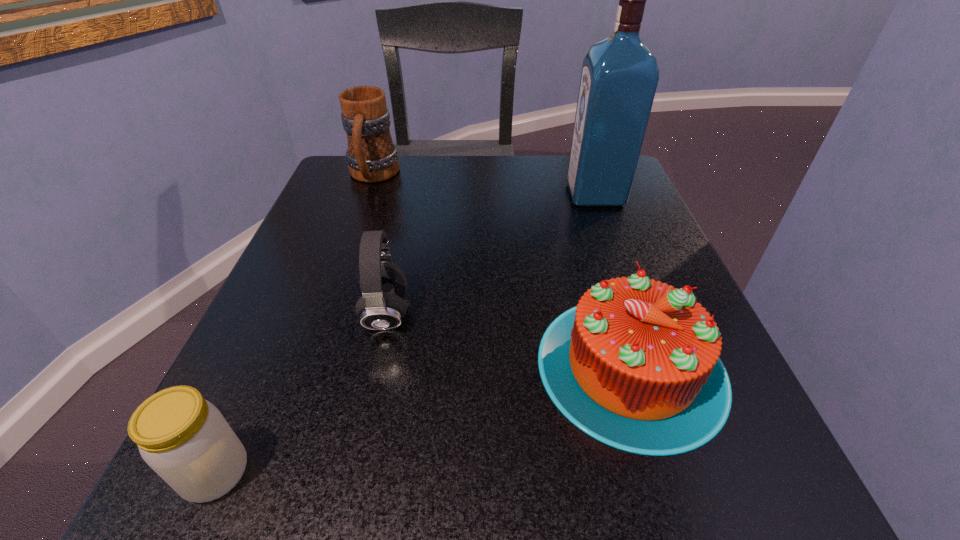
The image size is (960, 540). Find the location of `liquor`. liquor is located at coordinates (619, 78).

Find the location of a particular element. The image size is (960, 540). the fourth shortest object is located at coordinates (371, 156).

Image resolution: width=960 pixels, height=540 pixels. Find the location of `headset`. headset is located at coordinates (383, 285).

Locate an element on the screen. Image resolution: width=960 pixels, height=540 pixels. cake is located at coordinates (635, 365).

Find the location of a particular element. The height and width of the screenshot is (540, 960). jar is located at coordinates (184, 438).

At what (x,y) coordinates should I click in order to perform the action: click on free region located 0.070m on the flat label side of the liquor. Please return your answer as a coordinate pair (x, y). This screenshot has width=960, height=540. Looking at the image, I should click on (537, 194).

Find the location of a particular element. The height and width of the screenshot is (540, 960). free space located on the flat label side of the liquor is located at coordinates (495, 194).

Locate an element on the screen. The height and width of the screenshot is (540, 960). free space located 0.250m on the flat label side of the liquor is located at coordinates (453, 194).

Identify the location of vacant space situated 0.160m on the side of the mug with the handle. (350, 240).

You are a GUI agent. You are given a task and a screenshot of the screen. Output one action in this format:
    pyautogui.click(x=<x>, y=<y>)
    Task: Click on the vacant space located on the ear cups of the headset
    The image size is (960, 540).
    Given the screenshot: What is the action you would take?
    pyautogui.click(x=481, y=314)